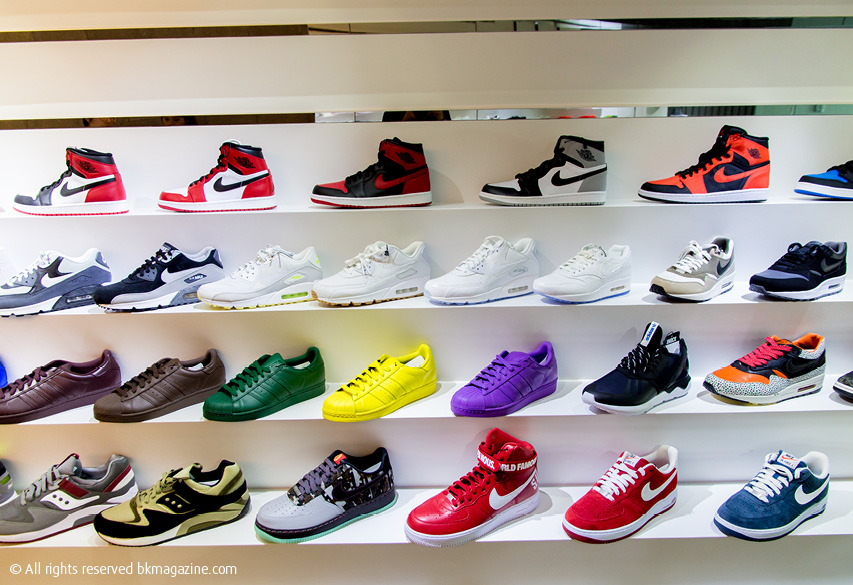
Identify the location of shoes on the bottom shelf. (4, 476), (45, 490), (177, 490), (317, 501), (483, 504), (627, 487), (764, 503).